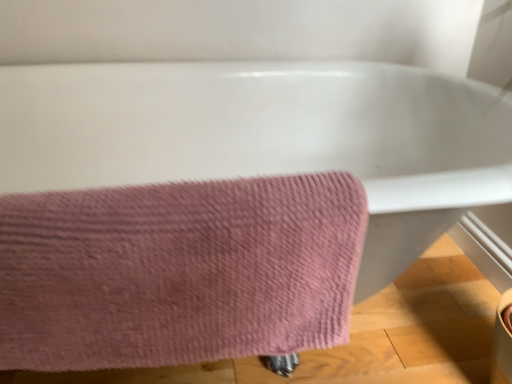
Question: From the image's perspective, relative to white glossy bathtub at upper center, is pink textured towel at lower left above or below?

Choices:
 (A) above
 (B) below

Answer: (B)

Question: Based on their sizes in the image, would you say pink textured towel at lower left is bigger or smaller than white glossy bathtub at upper center?

Choices:
 (A) small
 (B) big

Answer: (A)

Question: Considering the positions of point (238, 332) and point (20, 155), is point (238, 332) closer or farther from the camera than point (20, 155)?

Choices:
 (A) closer
 (B) farther

Answer: (A)

Question: Is white glossy bathtub at upper center taller or shorter than pink textured towel at lower left?

Choices:
 (A) short
 (B) tall

Answer: (B)

Question: In terms of size, does white glossy bathtub at upper center appear bigger or smaller than pink textured towel at lower left?

Choices:
 (A) big
 (B) small

Answer: (A)

Question: From the image's perspective, is white glossy bathtub at upper center above or below pink textured towel at lower left?

Choices:
 (A) above
 (B) below

Answer: (A)

Question: Do you think white glossy bathtub at upper center is within pink textured towel at lower left, or outside of it?

Choices:
 (A) inside
 (B) outside

Answer: (B)